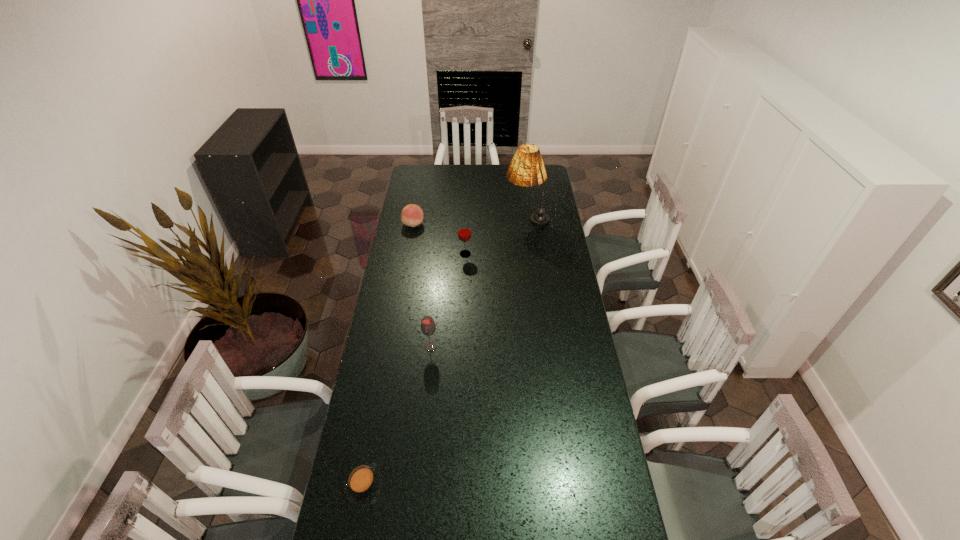
At what (x,y) coordinates should I click in order to perform the action: click on vacant space at the left edge of the desktop. Please return your answer as a coordinate pair (x, y). This screenshot has height=540, width=960. Looking at the image, I should click on (408, 241).

The image size is (960, 540). What are the coordinates of `vacant space at the right edge of the desktop` in the screenshot? It's located at (551, 338).

Identify the location of free spot between the cappuccino and the third farthest object. (415, 370).

Identify the location of vacant space that's between the fourth tallest object and the second object from right to left. The height and width of the screenshot is (540, 960). (440, 239).

At what (x,y) coordinates should I click in order to perform the action: click on vacant space that is in between the tallest object and the farther glass drink container. Please return your answer as a coordinate pair (x, y). The width and height of the screenshot is (960, 540). Looking at the image, I should click on (495, 236).

I want to click on free area in between the lampshade and the right glass drink container, so click(495, 236).

Identify the location of free space between the shortest object and the third nearest object. This screenshot has height=540, width=960. (415, 370).

The height and width of the screenshot is (540, 960). In order to click on free space between the cappuccino and the third object from right to left in this screenshot , I will do `click(397, 416)`.

I want to click on unoccupied position between the shortest object and the lampshade, so click(445, 352).

The width and height of the screenshot is (960, 540). Find the location of `empty location between the lampshade and the nearest object`. empty location between the lampshade and the nearest object is located at coordinates (445, 352).